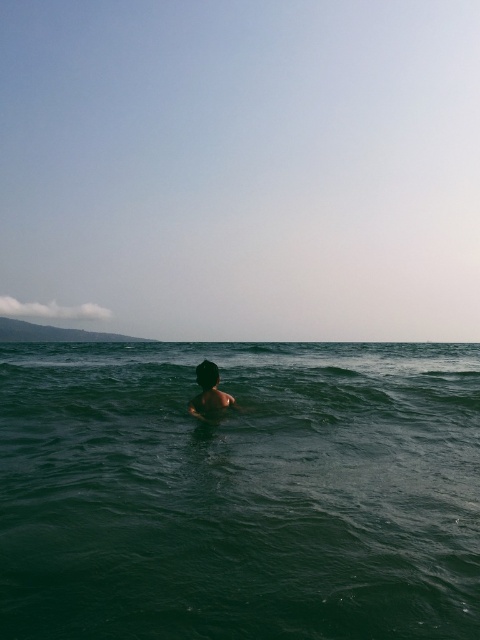
Measure the distance between green liquid water at center and camera.

green liquid water at center and camera are 3.61 meters apart from each other.

I want to click on green liquid water at center, so tap(240, 492).

Find the location of `green liquid water at center`. green liquid water at center is located at coordinates (240, 492).